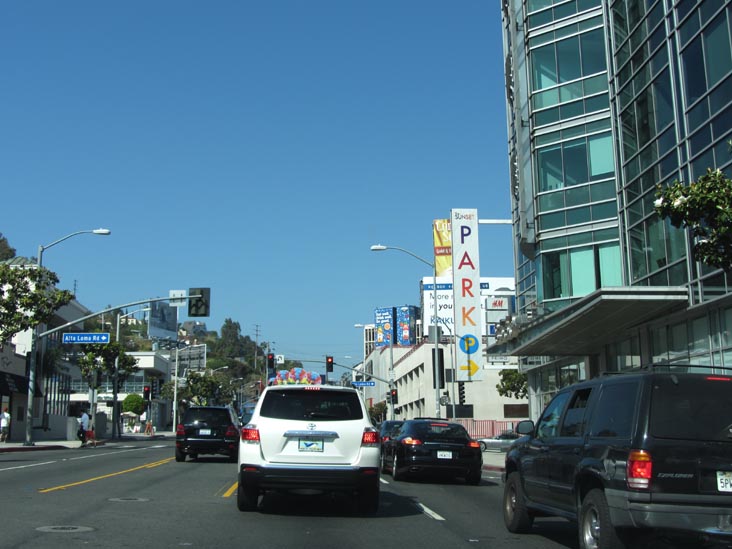
Locate an element on the screen. Image resolution: width=732 pixels, height=549 pixels. lamps is located at coordinates [102, 229], [378, 249].